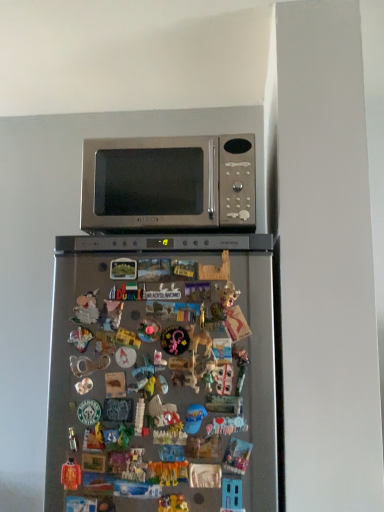
How much space does multicolored plastic toy at center, which ranks as the second toy in left-to-right order, occupy vertically?

The height of multicolored plastic toy at center, which ranks as the second toy in left-to-right order, is 2.31 inches.

The height and width of the screenshot is (512, 384). Identify the location of multicolored plastic toy at center, which ranks as the second toy in left-to-right order. (168, 472).

Is multicolored plastic toy at center, which appears as the second toy when viewed from the right, facing towards matte orange toy at lower left, the third toy positioned from the right?

No, multicolored plastic toy at center, which appears as the second toy when viewed from the right, is not facing towards matte orange toy at lower left, the third toy positioned from the right.

The width and height of the screenshot is (384, 512). I want to click on toy above the matte orange toy at lower left, the 1th toy viewed from the left (from a real-world perspective), so click(168, 472).

Can you confirm if multicolored plastic toy at center, which appears as the second toy when viewed from the right, is positioned to the left of matte orange toy at lower left, the 1th toy viewed from the left?

No, multicolored plastic toy at center, which appears as the second toy when viewed from the right, is not to the left of matte orange toy at lower left, the 1th toy viewed from the left.

From a real-world perspective, relative to satin silver microwave at upper center, is plastic toy at center, arranged as the third toy when viewed from the left, vertically above or below?

Clearly, from a real-world perspective, plastic toy at center, arranged as the third toy when viewed from the left, is below satin silver microwave at upper center.

Would you say plastic toy at center, arranged as the third toy when viewed from the left, is inside or outside satin silver microwave at upper center?

plastic toy at center, arranged as the third toy when viewed from the left, is located beyond the bounds of satin silver microwave at upper center.

Is plastic toy at center, arranged as the third toy when viewed from the left, looking in the opposite direction of satin silver microwave at upper center?

plastic toy at center, arranged as the third toy when viewed from the left, is not turned away from satin silver microwave at upper center.

Which object is closer to the camera taking this photo, satin silver refrigerator at center or multicolored plastic toy at center, which ranks as the second toy in left-to-right order?

satin silver refrigerator at center is more forward.

Between satin silver refrigerator at center and multicolored plastic toy at center, which appears as the second toy when viewed from the right, which one appears on the right side from the viewer's perspective?

From the viewer's perspective, satin silver refrigerator at center appears more on the right side.

From the image's perspective, is satin silver refrigerator at center above or below multicolored plastic toy at center, which ranks as the second toy in left-to-right order?

satin silver refrigerator at center is situated higher than multicolored plastic toy at center, which ranks as the second toy in left-to-right order, in the image.

From the image's perspective, is multicolored plastic toy at center, which appears as the second toy when viewed from the right, below satin silver microwave at upper center?

Correct, multicolored plastic toy at center, which appears as the second toy when viewed from the right, appears lower than satin silver microwave at upper center in the image.

Can we say multicolored plastic toy at center, which appears as the second toy when viewed from the right, lies outside satin silver microwave at upper center?

Indeed, multicolored plastic toy at center, which appears as the second toy when viewed from the right, is completely outside satin silver microwave at upper center.

Is multicolored plastic toy at center, which ranks as the second toy in left-to-right order, positioned with its back to satin silver microwave at upper center?

multicolored plastic toy at center, which ranks as the second toy in left-to-right order, is not turned away from satin silver microwave at upper center.

Considering the positions of objects multicolored plastic toy at center, which ranks as the second toy in left-to-right order, and satin silver microwave at upper center in the image provided, who is more to the left, multicolored plastic toy at center, which ranks as the second toy in left-to-right order, or satin silver microwave at upper center?

multicolored plastic toy at center, which ranks as the second toy in left-to-right order.

Identify the location of refrigerator above the matte orange toy at lower left, the 1th toy viewed from the left (from a real-world perspective). The image size is (384, 512). (162, 373).

Considering the positions of points (73, 473) and (132, 399), is point (73, 473) farther from camera compared to point (132, 399)?

Yes, point (73, 473) is behind point (132, 399).

Is matte orange toy at lower left, the 1th toy viewed from the left, surrounding satin silver refrigerator at center?

No, satin silver refrigerator at center is not surrounded by matte orange toy at lower left, the 1th toy viewed from the left.

From a real-world perspective, between matte orange toy at lower left, the 1th toy viewed from the left, and plastic toy at center, the 1th toy in the right-to-left sequence, who is vertically lower?

From a 3D spatial view, plastic toy at center, the 1th toy in the right-to-left sequence, is below.

Is matte orange toy at lower left, the third toy positioned from the right, in contact with plastic toy at center, arranged as the third toy when viewed from the left?

No, matte orange toy at lower left, the third toy positioned from the right, is not beside plastic toy at center, arranged as the third toy when viewed from the left.

Does point (71, 478) appear closer or farther from the camera than point (167, 495)?

Point (71, 478) is farther from the camera than point (167, 495).

Which object is thinner, matte orange toy at lower left, the third toy positioned from the right, or plastic toy at center, arranged as the third toy when viewed from the left?

With smaller width is plastic toy at center, arranged as the third toy when viewed from the left.

Considering the relative positions of satin silver microwave at upper center and plastic toy at center, arranged as the third toy when viewed from the left, in the image provided, is satin silver microwave at upper center to the left of plastic toy at center, arranged as the third toy when viewed from the left, from the viewer's perspective?

Yes, satin silver microwave at upper center is to the left of plastic toy at center, arranged as the third toy when viewed from the left.

Which is closer, (225, 159) or (168, 500)?

Point (168, 500)

Identify the location of microwave oven located above the plastic toy at center, arranged as the third toy when viewed from the left (from a real-world perspective). (168, 183).

Is satin silver microwave at upper center positioned with its back to plastic toy at center, arranged as the third toy when viewed from the left?

satin silver microwave at upper center does not have its back to plastic toy at center, arranged as the third toy when viewed from the left.

The image size is (384, 512). Find the location of `toy above the matte orange toy at lower left, the 1th toy viewed from the left (from a real-world perspective)`. toy above the matte orange toy at lower left, the 1th toy viewed from the left (from a real-world perspective) is located at coordinates (168, 472).

From the image's perspective, starting from the satin silver microwave at upper center, which toy is the 3rd one below? Please provide its 2D coordinates.

[(173, 503)]

Looking at this image, based on their spatial positions, is satin silver refrigerator at center or matte orange toy at lower left, the third toy positioned from the right, closer to satin silver microwave at upper center?

Based on the image, satin silver refrigerator at center appears to be nearer to satin silver microwave at upper center.

Looking at the image, which one is located closer to satin silver refrigerator at center, matte orange toy at lower left, the third toy positioned from the right, or multicolored plastic toy at center, which ranks as the second toy in left-to-right order?

multicolored plastic toy at center, which ranks as the second toy in left-to-right order.

Based on their spatial positions, is multicolored plastic toy at center, which ranks as the second toy in left-to-right order, or satin silver refrigerator at center further from satin silver microwave at upper center?

Based on the image, multicolored plastic toy at center, which ranks as the second toy in left-to-right order, appears to be further to satin silver microwave at upper center.

Which object lies further to the anchor point multicolored plastic toy at center, which ranks as the second toy in left-to-right order, satin silver refrigerator at center or matte orange toy at lower left, the third toy positioned from the right?

The object further to multicolored plastic toy at center, which ranks as the second toy in left-to-right order, is satin silver refrigerator at center.

When comparing their distances from plastic toy at center, the 1th toy in the right-to-left sequence, does matte orange toy at lower left, the 1th toy viewed from the left, or satin silver refrigerator at center seem further?

satin silver refrigerator at center is further to plastic toy at center, the 1th toy in the right-to-left sequence.

In the scene shown: Based on their spatial positions, is satin silver refrigerator at center or multicolored plastic toy at center, which ranks as the second toy in left-to-right order, closer to matte orange toy at lower left, the 1th toy viewed from the left?

Among the two, multicolored plastic toy at center, which ranks as the second toy in left-to-right order, is located nearer to matte orange toy at lower left, the 1th toy viewed from the left.

Estimate the real-world distances between objects in this image. Which object is further from satin silver refrigerator at center, multicolored plastic toy at center, which ranks as the second toy in left-to-right order, or plastic toy at center, arranged as the third toy when viewed from the left?

plastic toy at center, arranged as the third toy when viewed from the left.

Estimate the real-world distances between objects in this image. Which object is further from plastic toy at center, the 1th toy in the right-to-left sequence, matte orange toy at lower left, the third toy positioned from the right, or satin silver microwave at upper center?

satin silver microwave at upper center is positioned further to the anchor plastic toy at center, the 1th toy in the right-to-left sequence.

Identify the location of toy between matte orange toy at lower left, the 1th toy viewed from the left, and satin silver refrigerator at center, in the horizontal direction. (168, 472).

The height and width of the screenshot is (512, 384). Identify the location of refrigerator between matte orange toy at lower left, the third toy positioned from the right, and plastic toy at center, arranged as the third toy when viewed from the left, from left to right. (162, 373).

Locate an element on the screen. Image resolution: width=384 pixels, height=512 pixels. refrigerator that lies between satin silver microwave at upper center and matte orange toy at lower left, the third toy positioned from the right, from top to bottom is located at coordinates (162, 373).

Locate an element on the screen. This screenshot has width=384, height=512. toy that lies between satin silver microwave at upper center and matte orange toy at lower left, the third toy positioned from the right, from top to bottom is located at coordinates (168, 472).